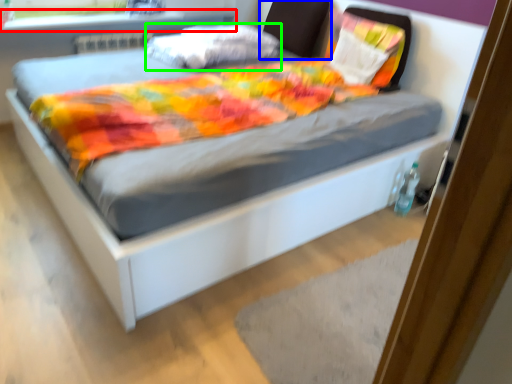
Question: Based on their relative distances, which object is nearer to window sill (highlighted by a red box)? Choose from headboard (highlighted by a blue box) and pillow (highlighted by a green box).

Choices:
 (A) headboard
 (B) pillow

Answer: (B)